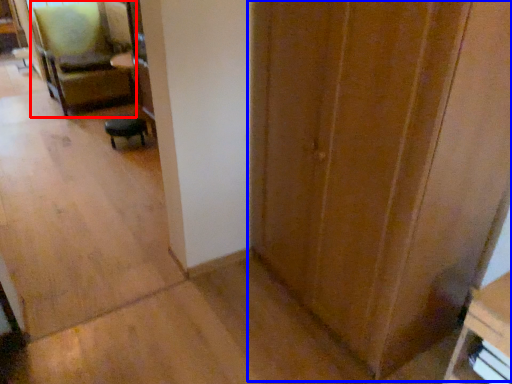
Question: Which object is further to the camera taking this photo, chair (highlighted by a red box) or door (highlighted by a blue box)?

Choices:
 (A) chair
 (B) door

Answer: (A)